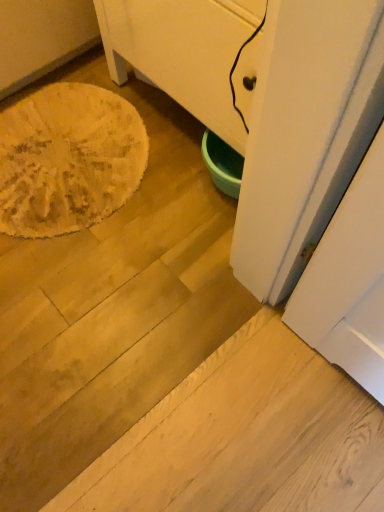
Question: Should I look upward or downward to see green plastic bowl at lower center?

Choices:
 (A) down
 (B) up

Answer: (B)